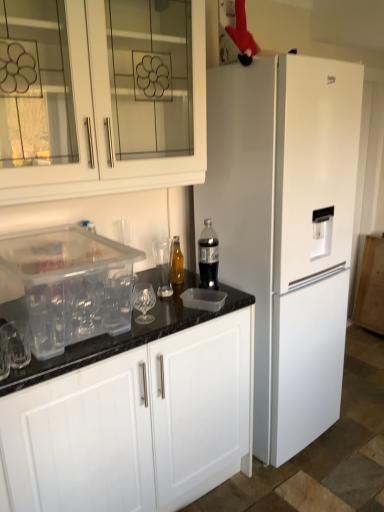
The image size is (384, 512). Find the location of `vacant space to the left of translucent plastic bottle at center, arranged as the 1th bottle when viewed from the right`. vacant space to the left of translucent plastic bottle at center, arranged as the 1th bottle when viewed from the right is located at coordinates (170, 293).